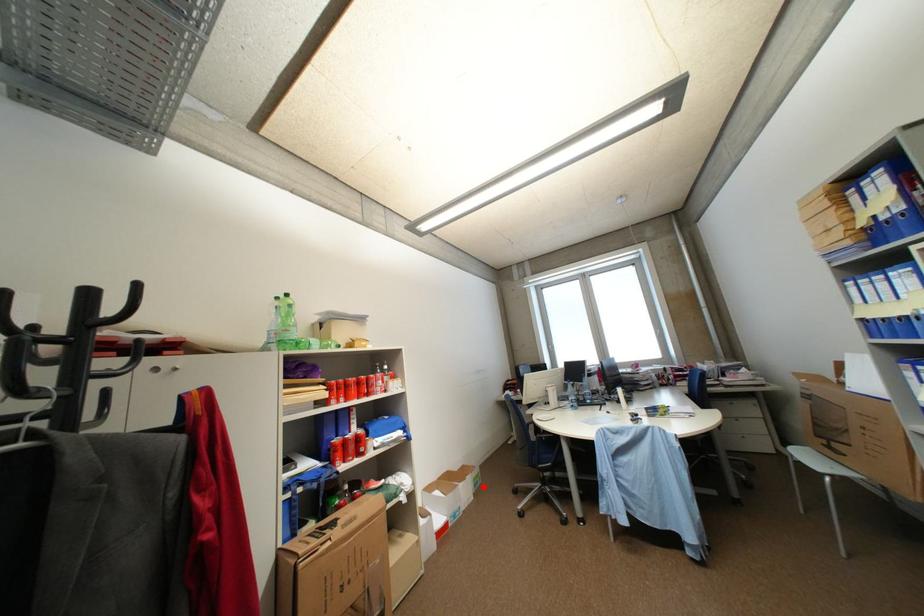
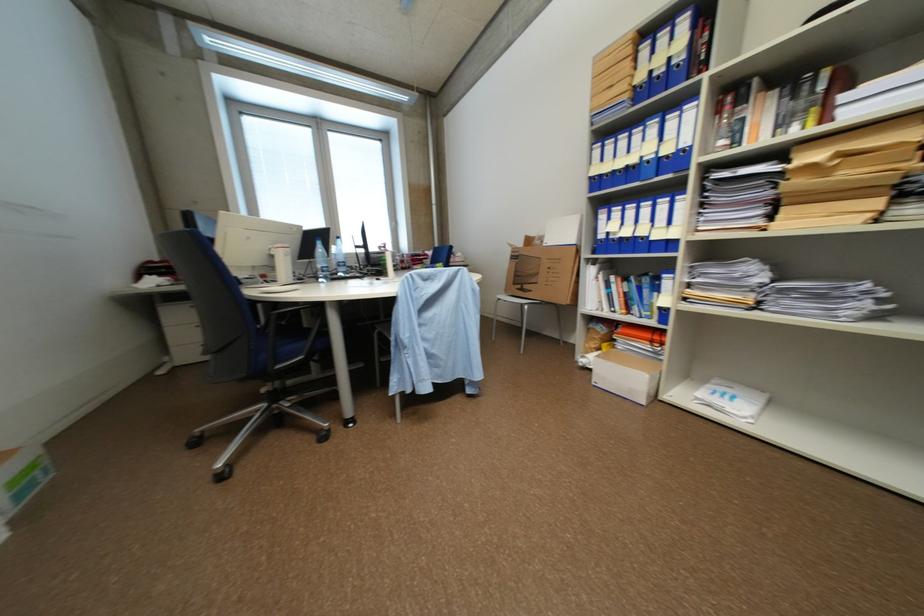
Question: I am providing you with two images of the same scene from different viewpoints. In image1, a red point is highlighted. Considering the same 3D point in image2, which of the following is correct?

Choices:
 (A) It is closer
 (B) It is farther

Answer: (B)